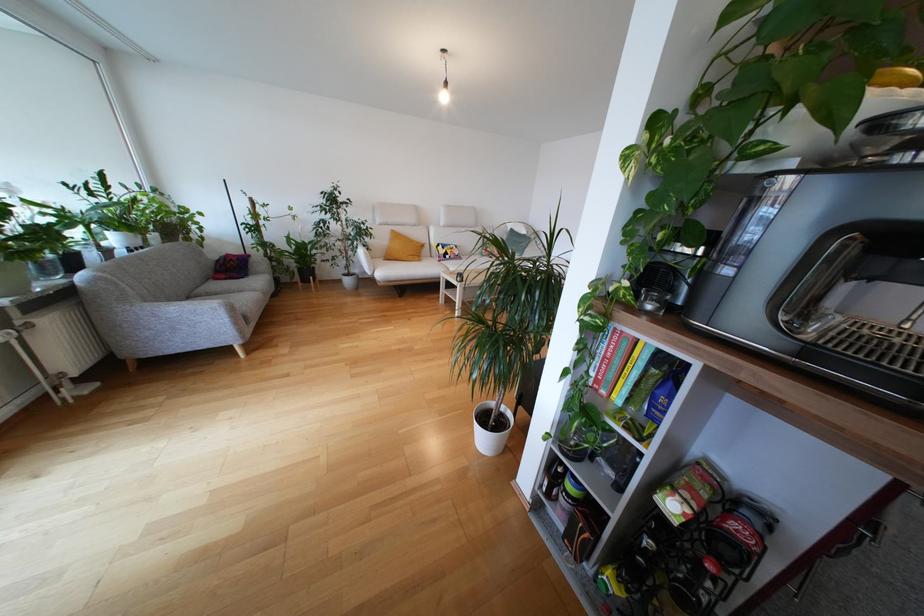
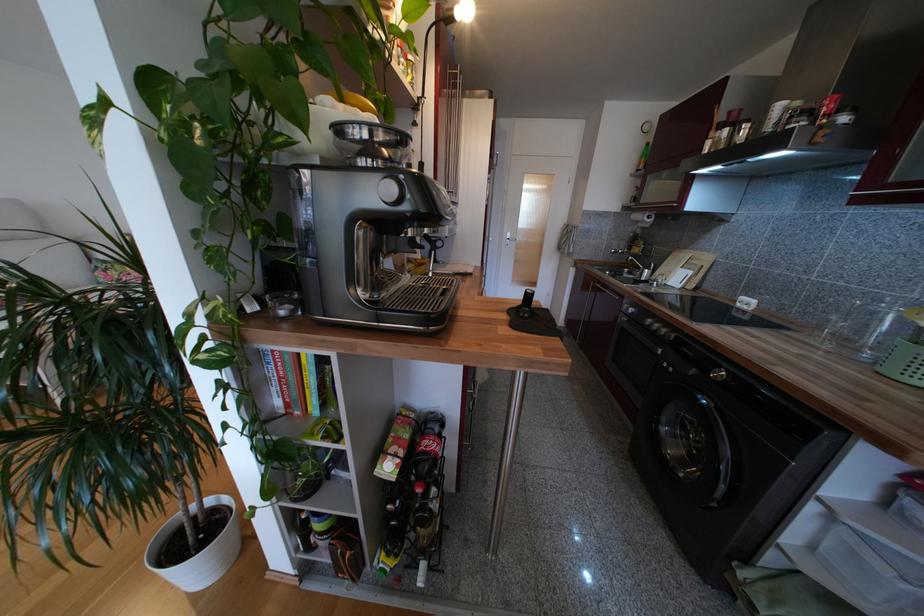
Question: The camera is either moving clockwise (left) or counter-clockwise (right) around the object. The first image is from the beginning of the video and the second image is from the end. Is the camera moving left or right when shooting the video?

Choices:
 (A) Left
 (B) Right

Answer: (A)